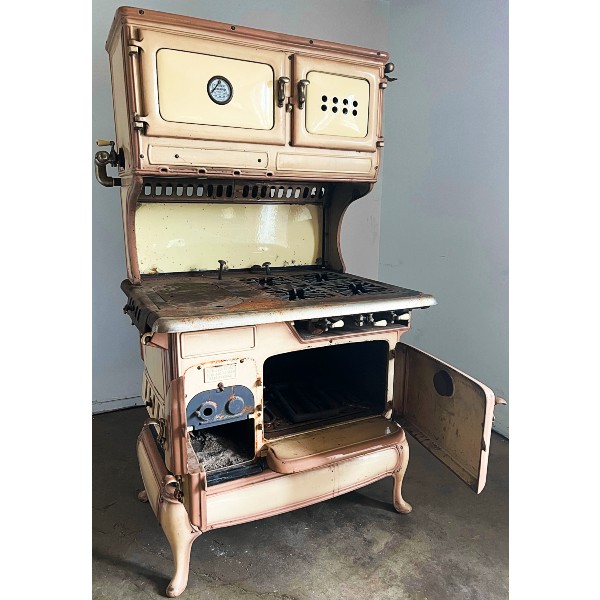
The image size is (600, 600). Find the location of `door`. door is located at coordinates (458, 412).